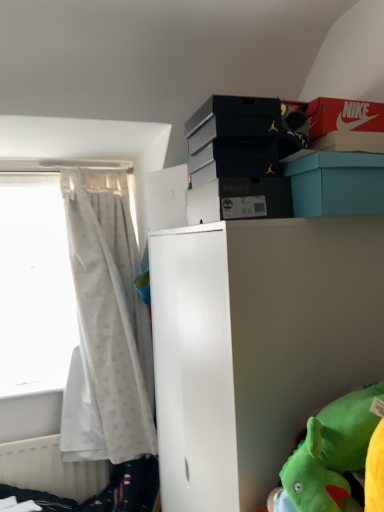
Where is `vacant area on top of white plastic radiator at lower left (from a real-world perspective)`? The width and height of the screenshot is (384, 512). vacant area on top of white plastic radiator at lower left (from a real-world perspective) is located at coordinates (33, 428).